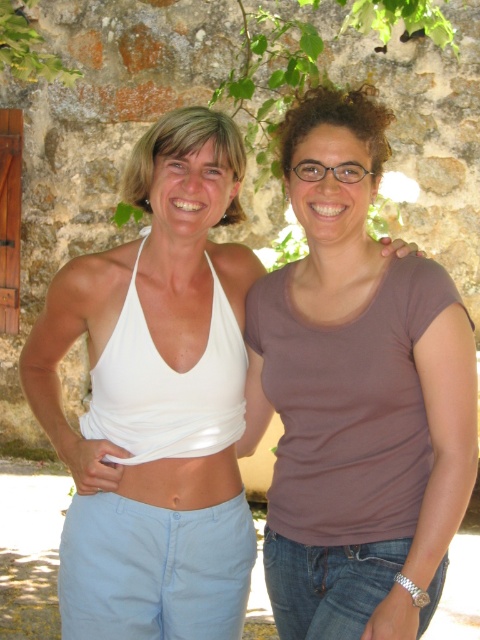
Question: Is brown matte shirt at center to the left of white fabric top at center from the viewer's perspective?

Choices:
 (A) yes
 (B) no

Answer: (B)

Question: Among these objects, which one is nearest to the camera?

Choices:
 (A) white fabric top at center
 (B) brown matte shirt at center

Answer: (B)

Question: Which point is farther to the camera?

Choices:
 (A) white fabric top at center
 (B) brown matte shirt at center

Answer: (A)

Question: Does brown matte shirt at center appear over white fabric top at center?

Choices:
 (A) yes
 (B) no

Answer: (A)

Question: Is brown matte shirt at center below white fabric top at center?

Choices:
 (A) yes
 (B) no

Answer: (B)

Question: Which point is closer to the camera?

Choices:
 (A) brown matte shirt at center
 (B) matte brown hair at upper center
 (C) white matte bikini top at left
 (D) white fabric top at center

Answer: (A)